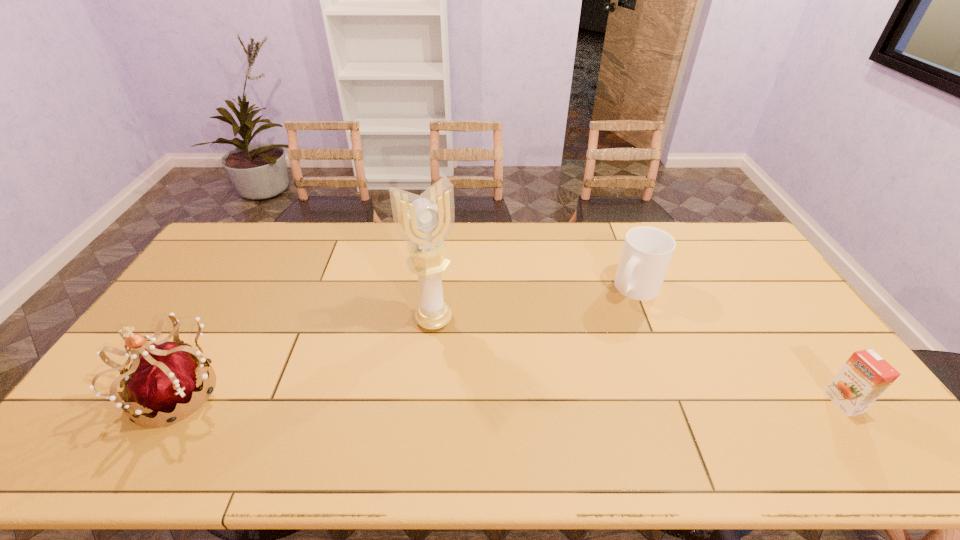
Find the location of `vacant area that lies between the second object from left to right and the shortest object`. vacant area that lies between the second object from left to right and the shortest object is located at coordinates (638, 361).

This screenshot has width=960, height=540. Find the location of `free space that is in between the leftmost object and the shortest object`. free space that is in between the leftmost object and the shortest object is located at coordinates (511, 397).

Where is `vacant space that is in between the tallest object and the orange juice`? vacant space that is in between the tallest object and the orange juice is located at coordinates (638, 361).

Where is `free space between the orange juice and the tiara`? free space between the orange juice and the tiara is located at coordinates (511, 397).

What are the coordinates of `free spot between the tiara and the second object from right to left` in the screenshot? It's located at (407, 340).

Locate which object ranks third in proximity to the leftmost object. Please provide its 2D coordinates. Your answer should be formatted as a tuple, i.e. [(x, y)], where the tuple contains the x and y coordinates of a point satisfying the conditions above.

[(866, 375)]

Locate an element on the screen. The height and width of the screenshot is (540, 960). object that ranks as the closest to the tiara is located at coordinates (424, 221).

You are a GUI agent. You are given a task and a screenshot of the screen. Output one action in this format:
    pyautogui.click(x=<x>, y=<y>)
    Task: Click on the vacant area in the image that satisfies the following two spatial constraints: 1. on the front side of the rightmost object; 2. on the right side of the tallest object
    
    Given the screenshot: What is the action you would take?
    pyautogui.click(x=425, y=402)